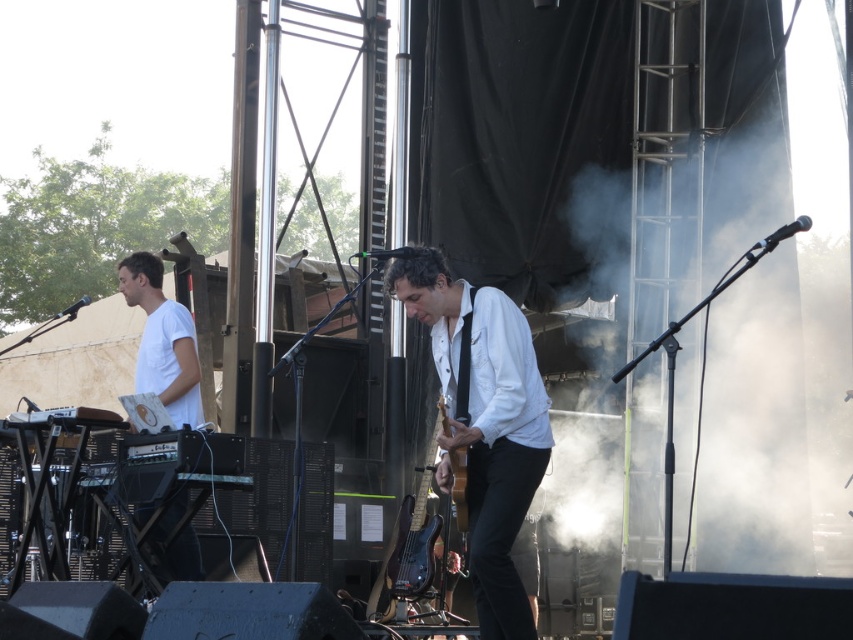
Does white matte shirt at center appear on the left side of wooden acoustic guitar at center?

In fact, white matte shirt at center is to the right of wooden acoustic guitar at center.

Is white matte shirt at center bigger than wooden acoustic guitar at center?

Yes, white matte shirt at center is bigger than wooden acoustic guitar at center.

Image resolution: width=853 pixels, height=640 pixels. What do you see at coordinates (483, 422) in the screenshot?
I see `white matte shirt at center` at bounding box center [483, 422].

In order to click on white matte shirt at center in this screenshot , I will do `click(483, 422)`.

Is white matte shirt at center shorter than white matte shirt at left?

Incorrect, white matte shirt at center's height does not fall short of white matte shirt at left's.

Can you confirm if white matte shirt at center is positioned below white matte shirt at left?

Correct, white matte shirt at center is located below white matte shirt at left.

You are a GUI agent. You are given a task and a screenshot of the screen. Output one action in this format:
    pyautogui.click(x=<x>, y=<y>)
    Task: Click on the white matte shirt at center
    The width and height of the screenshot is (853, 640).
    Given the screenshot: What is the action you would take?
    pyautogui.click(x=483, y=422)

Where is `white matte shirt at center`? white matte shirt at center is located at coordinates (483, 422).

Who is taller, white matte shirt at left or wooden acoustic guitar at center?

With more height is white matte shirt at left.

Does white matte shirt at left have a greater height compared to wooden acoustic guitar at center?

Yes.

Between point (195, 556) and point (456, 452), which one is positioned behind?

The point (195, 556) is more distant.

Image resolution: width=853 pixels, height=640 pixels. I want to click on white matte shirt at left, so click(161, 340).